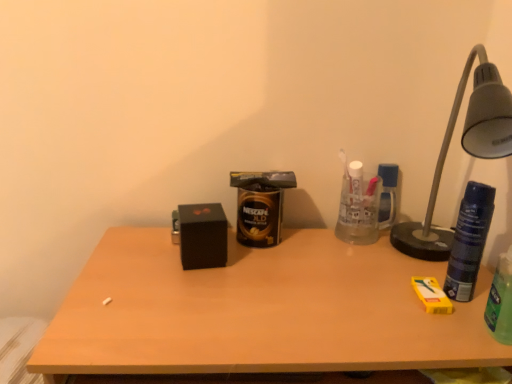
At what (x,y) coordinates should I click in order to perform the action: click on free location in front of black matte box at center. Please return your answer as a coordinate pair (x, y). This screenshot has width=512, height=384. Looking at the image, I should click on (194, 306).